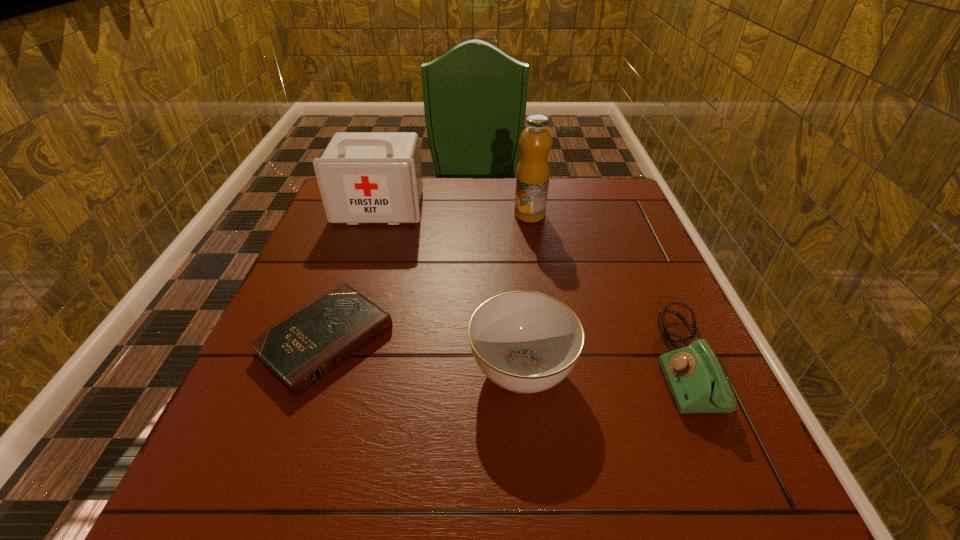
This screenshot has height=540, width=960. What are the coordinates of `free spot located 0.200m on the dial of the telephone` in the screenshot? It's located at (553, 361).

I want to click on vacant space situated 0.070m on the dial of the telephone, so pyautogui.click(x=620, y=361).

Locate an element on the screen. This screenshot has height=540, width=960. free location located 0.050m on the front of the Bible is located at coordinates (298, 423).

The height and width of the screenshot is (540, 960). Find the location of `fruit juice that is at the far edge`. fruit juice that is at the far edge is located at coordinates (532, 178).

Locate an element on the screen. the first-aid kit situated at the far edge is located at coordinates click(364, 177).

I want to click on the first-aid kit that is at the left edge, so click(x=364, y=177).

Find the location of a particular element. The width and height of the screenshot is (960, 540). Bible located at the left edge is located at coordinates (300, 351).

Identify the location of object positioned at the right edge. This screenshot has height=540, width=960. (697, 382).

Locate an element on the screen. Image resolution: width=960 pixels, height=540 pixels. object that is at the far left corner is located at coordinates (364, 177).

The height and width of the screenshot is (540, 960). In order to click on free space at the far edge in this screenshot , I will do `click(478, 219)`.